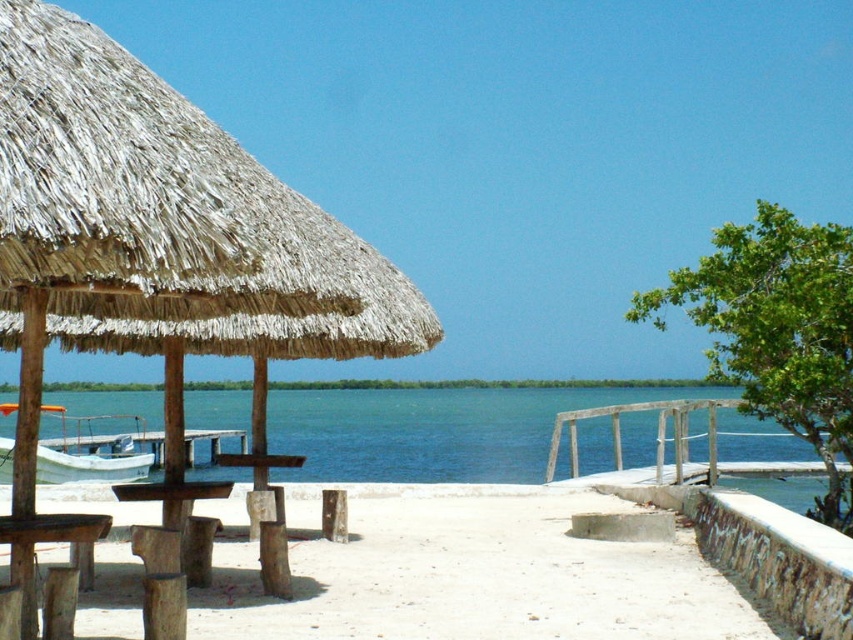
You are standing on the smooth concrete beach at center and want to reach the blue water at center. Which direction should you walk to get there?

You should walk to the right because the smooth concrete beach at center is to the left of the blue water at center, so moving right will lead you towards the blue water at center.

You are planning to build a small sandcastle on the smooth concrete beach at center and the blue water at center. Which location has more space for building a larger sandcastle?

The blue water at center has a greater width than the smooth concrete beach at center, so it offers more space for building a larger sandcastle.

You are standing at the edge of the coastal scene and want to reach the thatched straw umbrella at left. Given that the average walking distance for a person is about 15 feet, do you think you can comfortably walk to it without feeling rushed?

The distance between you and the thatched straw umbrella at left is 13.50 feet, which is within the average walking distance of 15 feet. Therefore, you can comfortably walk to it without feeling rushed.